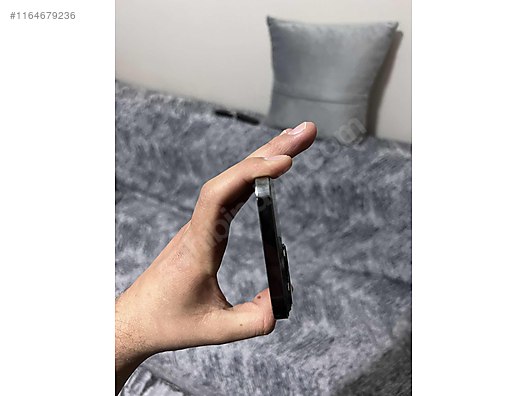
The image size is (528, 396). What are the coordinates of `silver grey pillow` in the screenshot? It's located at (326, 60).